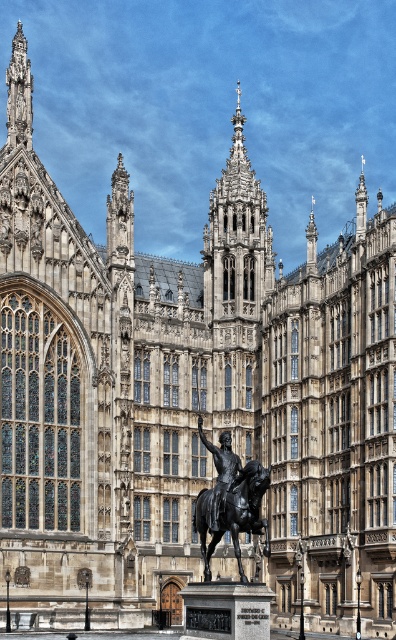
Between stone gothic tower at center and polished bronze horse at center, which one has more height?

stone gothic tower at center is taller.

Is the position of stone gothic tower at center less distant than that of polished bronze horse at center?

No.

Who is more distant from viewer, (x=247, y=260) or (x=268, y=481)?

The point (x=247, y=260) is more distant.

Locate an element on the screen. stone gothic tower at center is located at coordinates (236, 237).